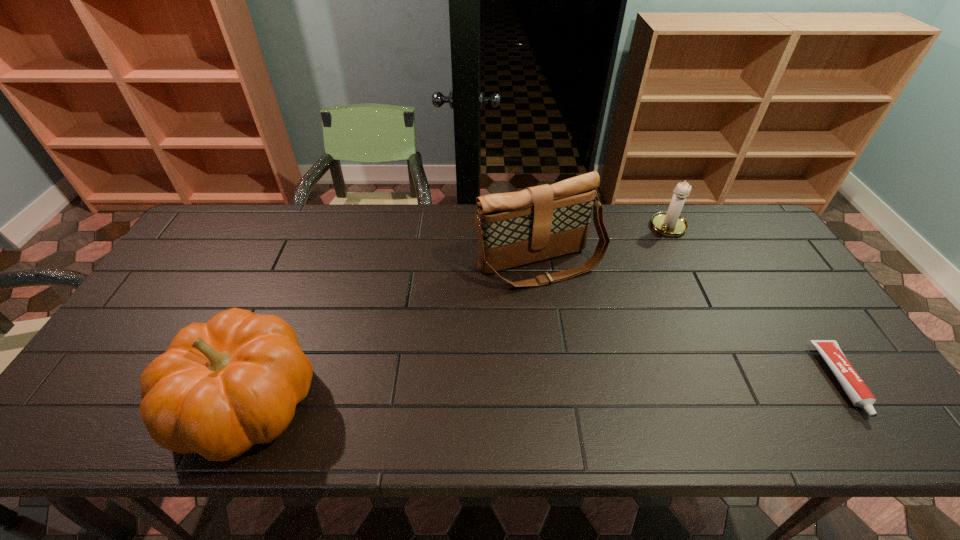
The image size is (960, 540). In the image, there is a desktop. Find the location of `blank space at the far edge`. blank space at the far edge is located at coordinates (355, 236).

This screenshot has height=540, width=960. I want to click on free region at the near edge of the desktop, so click(x=505, y=372).

Identify the location of free location at the left edge. (195, 283).

Identify the location of vacant area at the right edge. This screenshot has height=540, width=960. (763, 312).

This screenshot has height=540, width=960. In the image, there is a desktop. What are the coordinates of `free space at the far right corner` in the screenshot? It's located at (757, 234).

At what (x,y) coordinates should I click in order to perform the action: click on vacant space at the near right corner. Please return your answer as a coordinate pair (x, y). Looking at the image, I should click on (832, 383).

What are the coordinates of `free space between the pumpkin and the third object from left to right` in the screenshot? It's located at (458, 315).

Identify the location of free spot between the third object from left to right and the shortest object. This screenshot has width=960, height=540. (756, 303).

Find the location of a particular element. The width and height of the screenshot is (960, 540). free spot between the third nearest object and the leftmost object is located at coordinates (394, 334).

Identify the location of free point between the leftmost object and the shortest object. (544, 392).